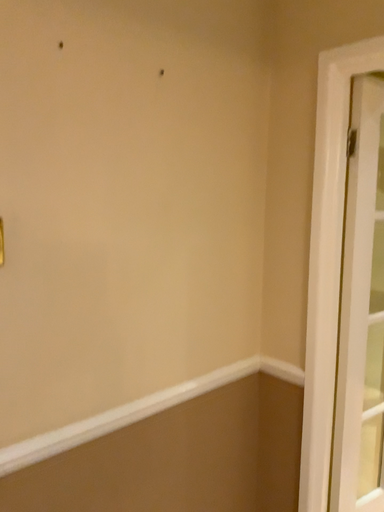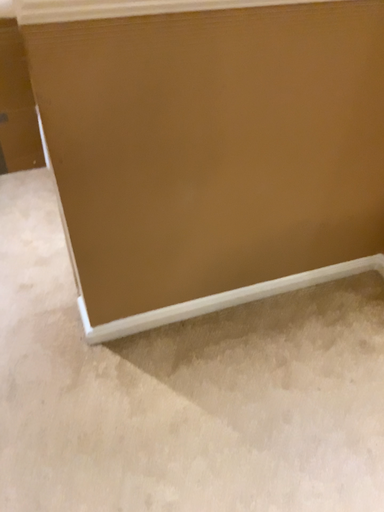
Question: How did the camera likely rotate when shooting the video?

Choices:
 (A) rotated upward
 (B) rotated downward

Answer: (B)